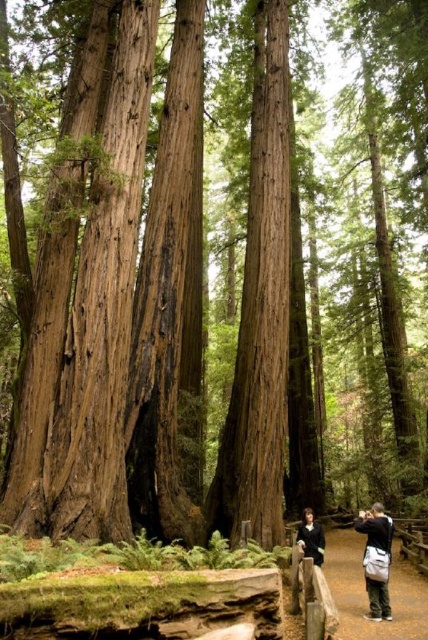
Question: Which point is farther to the camera?

Choices:
 (A) dark gray fabric camera bag at lower right
 (B) brown dirt path at center

Answer: (A)

Question: Is brown dirt path at center bigger than dark gray fabric camera bag at lower right?

Choices:
 (A) yes
 (B) no

Answer: (A)

Question: Does brown dirt path at center have a lesser width compared to dark gray fabric camera bag at lower right?

Choices:
 (A) yes
 (B) no

Answer: (B)

Question: Does brown dirt path at center have a smaller size compared to dark gray fabric camera bag at lower right?

Choices:
 (A) yes
 (B) no

Answer: (B)